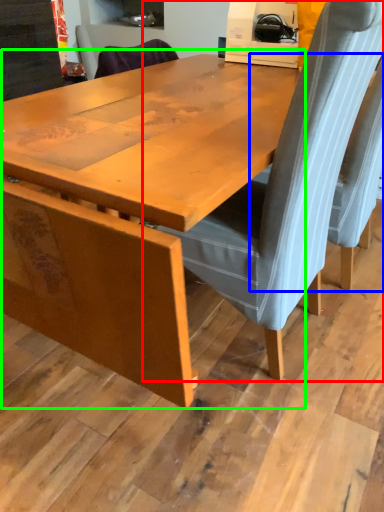
Question: Which is nearer to the chair (highlighted by a red box)? chair (highlighted by a blue box) or table (highlighted by a green box).

Choices:
 (A) chair
 (B) table

Answer: (B)